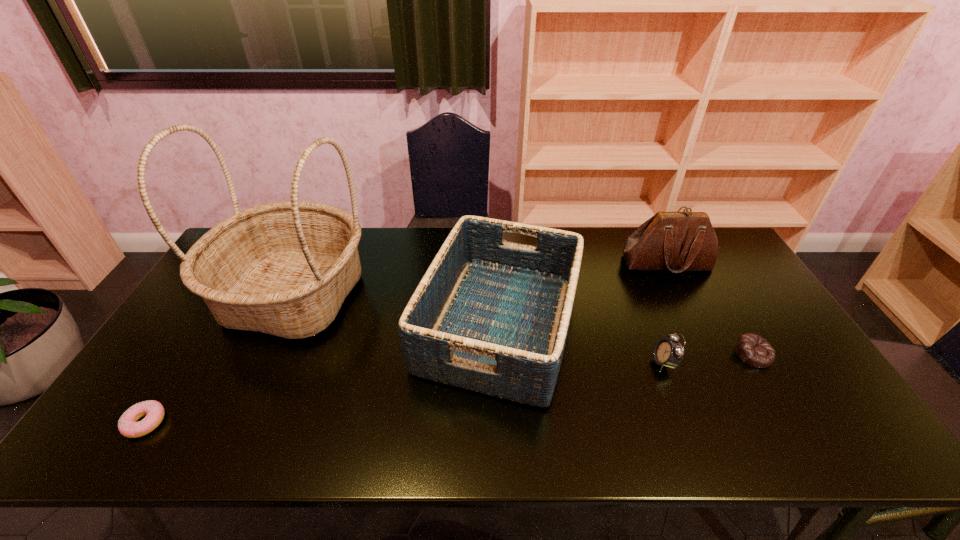
Image resolution: width=960 pixels, height=540 pixels. In order to click on vacant point located on the right of the right basket in this screenshot , I will do `click(659, 325)`.

Image resolution: width=960 pixels, height=540 pixels. Find the location of `free space located 0.350m on the face of the fourth tallest object`. free space located 0.350m on the face of the fourth tallest object is located at coordinates (519, 363).

What are the coordinates of `blank space located 0.190m on the face of the fourth tallest object` in the screenshot? It's located at (580, 363).

Locate an element on the screen. This screenshot has width=960, height=540. free space located 0.180m on the face of the fourth tallest object is located at coordinates (584, 363).

Locate an element on the screen. The image size is (960, 540). vacant position located 0.230m on the front of the beanbag is located at coordinates (812, 453).

This screenshot has width=960, height=540. I want to click on vacant space located on the right of the doughnut, so pos(233,423).

This screenshot has height=540, width=960. In order to click on shoulder bag located at the far edge in this screenshot , I will do 677,241.

Image resolution: width=960 pixels, height=540 pixels. In order to click on object that is at the near edge in this screenshot , I will do `click(128, 426)`.

In order to click on basket at the left edge in this screenshot , I will do `click(284, 268)`.

The height and width of the screenshot is (540, 960). Find the location of `doughnut present at the left edge`. doughnut present at the left edge is located at coordinates (128, 426).